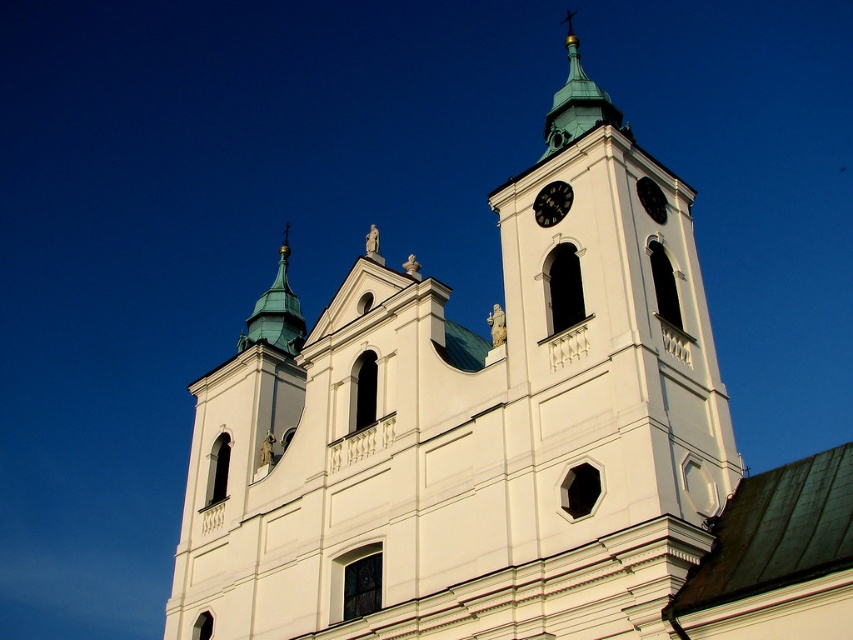
You are a tourist standing in front of the church and want to take a photo that includes both the white stone tower at center and the green copper spire at upper center. Which one of the two objects should you focus on first to ensure both are in frame?

You should focus on the white stone tower at center first because it is shorter than the green copper spire at upper center, so adjusting the frame to include the taller spire will naturally include the shorter tower as well.

You are standing at the point marked by point (x=473, y=436) in the image. Looking around, you see the white stone tower at center. Which direction should you face to see the green domes on the corners of the church building?

Since you are standing at the point marked by point (x=473, y=436) which is the white stone tower at center, you should face outward towards the corners of the church building to see the green domes. The green domes are located at the corners, so facing away from the center towards either side would allow you to see them.

You are a drone operator tasked with capturing aerial footage of the church. Your drone has a maximum flight range of 25 meters. If you are positioned at the white stone tower at center, can you safely fly your drone to the green copper spire at upper center without exceeding its range?

The distance between the white stone tower at center and the green copper spire at upper center is 24.79 meters, which is within the drone operator s 25 meter range. Therefore, the drone can safely fly to the green copper spire at upper center without exceeding its maximum flight range.